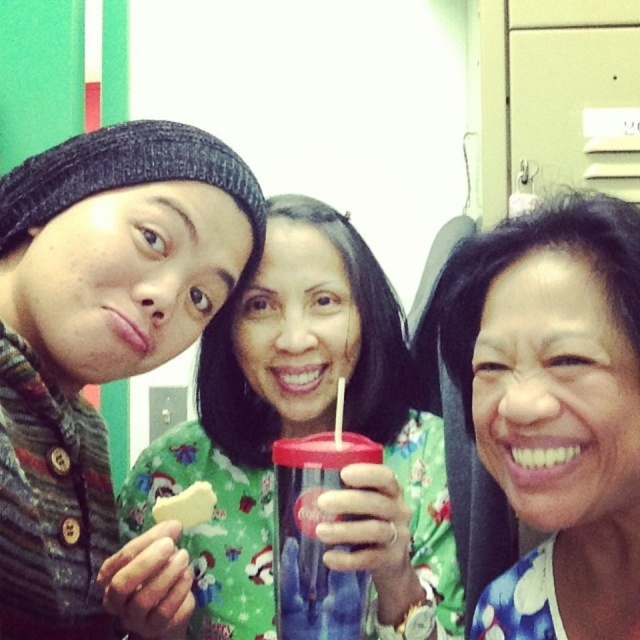
Can you confirm if green fabric shirt at center is positioned below floral fabric shirt at center?

Indeed, green fabric shirt at center is positioned under floral fabric shirt at center.

The width and height of the screenshot is (640, 640). Find the location of `green fabric shirt at center`. green fabric shirt at center is located at coordinates click(294, 435).

Locate an element on the screen. The image size is (640, 640). green fabric shirt at center is located at coordinates (294, 435).

Who is lower down, green fabric shirt at center or matte black beanie at upper left?

green fabric shirt at center is below.

Is green fabric shirt at center positioned in front of matte black beanie at upper left?

That is False.

Which is in front, point (305, 321) or point (128, 136)?

Positioned in front is point (128, 136).

In order to click on green fabric shirt at center in this screenshot , I will do `click(294, 435)`.

Does matte black beanie at upper left have a greater width compared to translucent plastic cup at center?

Yes.

Can you confirm if matte black beanie at upper left is positioned above translucent plastic cup at center?

Indeed, matte black beanie at upper left is positioned over translucent plastic cup at center.

Between point (13, 353) and point (320, 627), which one is positioned behind?

The point (320, 627) is behind.

Where is `matte black beanie at upper left`? This screenshot has width=640, height=640. matte black beanie at upper left is located at coordinates (99, 337).